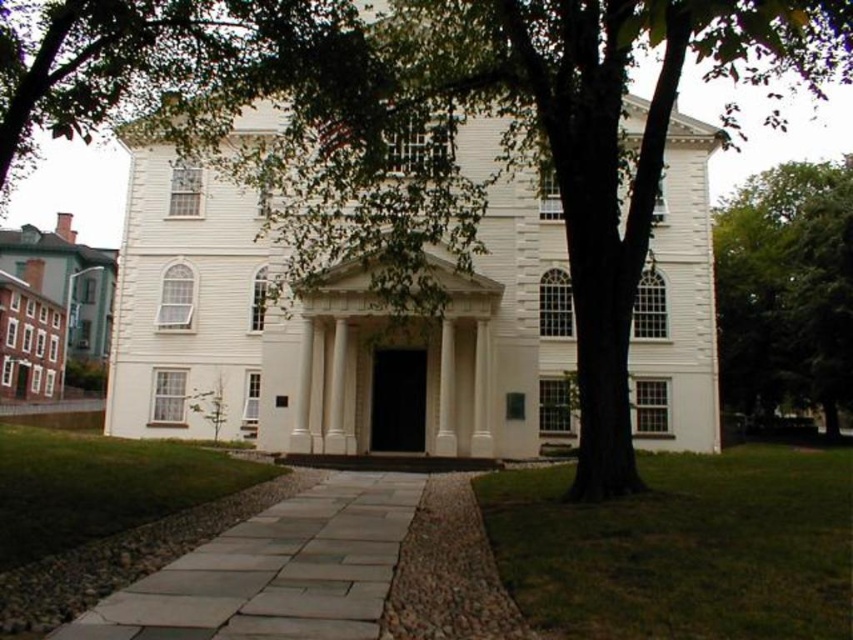
Question: From the image, what is the correct spatial relationship of gray stone pathway at center in relation to green leafy tree at right?

Choices:
 (A) left
 (B) right

Answer: (A)

Question: Which point is farther to the camera?

Choices:
 (A) green leafy tree at right
 (B) gray stone pathway at center

Answer: (A)

Question: From the image, what is the correct spatial relationship of gray stone pathway at center in relation to green leafy tree at right?

Choices:
 (A) below
 (B) above

Answer: (A)

Question: Is gray stone pathway at center wider than green leafy tree at right?

Choices:
 (A) yes
 (B) no

Answer: (B)